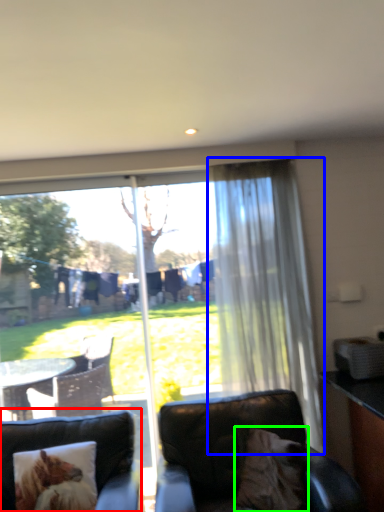
Question: Based on their relative distances, which object is nearer to studio couch (highlighted by a red box)? Choose from curtain (highlighted by a blue box) and pillow (highlighted by a green box).

Choices:
 (A) curtain
 (B) pillow

Answer: (B)